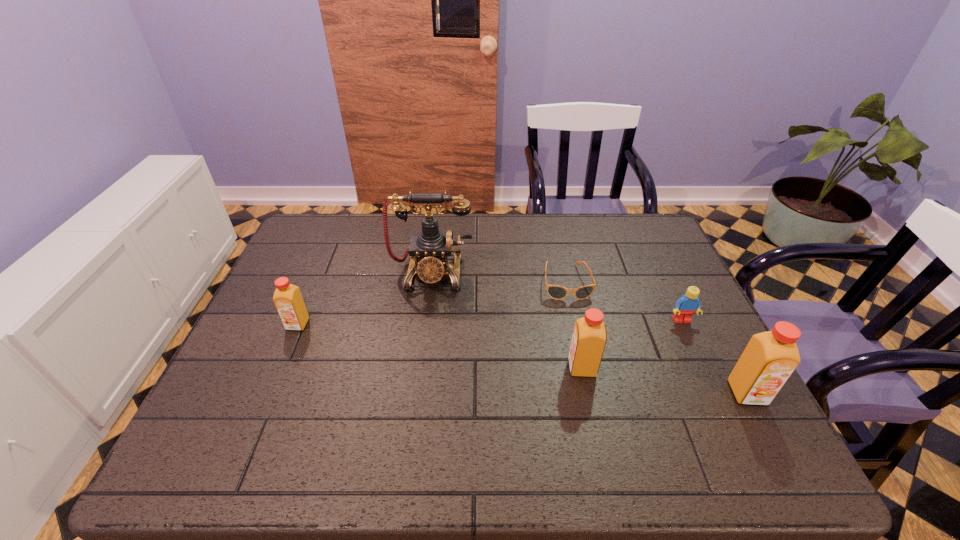
Image resolution: width=960 pixels, height=540 pixels. Find the location of `vacant point located 0.160m on the front and back of the leftmost orange juice`. vacant point located 0.160m on the front and back of the leftmost orange juice is located at coordinates (273, 384).

At what (x,y) coordinates should I click in order to perform the action: click on vacant space situated on the front and back of the second farthest orange juice. Please return your answer as a coordinate pair (x, y). Looking at the image, I should click on (522, 368).

In order to click on blank area located on the front and back of the second farthest orange juice in this screenshot , I will do `click(479, 368)`.

You are a GUI agent. You are given a task and a screenshot of the screen. Output one action in this format:
    pyautogui.click(x=<x>, y=<y>)
    Task: Click on the blank space located 0.320m on the front and back of the second farthest orange juice
    The image size is (960, 540).
    Given the screenshot: What is the action you would take?
    pyautogui.click(x=433, y=368)

This screenshot has height=540, width=960. What are the coordinates of `vacant space situated 0.120m on the front of the tallest object, featuring the rotary dial` in the screenshot? It's located at (424, 327).

This screenshot has height=540, width=960. What are the coordinates of `free space located on the front-facing side of the sunglasses` in the screenshot? It's located at (579, 343).

Identify the location of vacant space located on the face of the fifth tallest object. (723, 406).

You are a GUI agent. You are given a task and a screenshot of the screen. Output one action in this format:
    pyautogui.click(x=<x>, y=<y>)
    Task: Click on the object at the far edge
    
    Given the screenshot: What is the action you would take?
    pyautogui.click(x=429, y=250)

The width and height of the screenshot is (960, 540). What are the coordinates of `object present at the near edge` in the screenshot? It's located at (769, 359).

This screenshot has height=540, width=960. I want to click on object located at the left edge, so click(x=287, y=298).